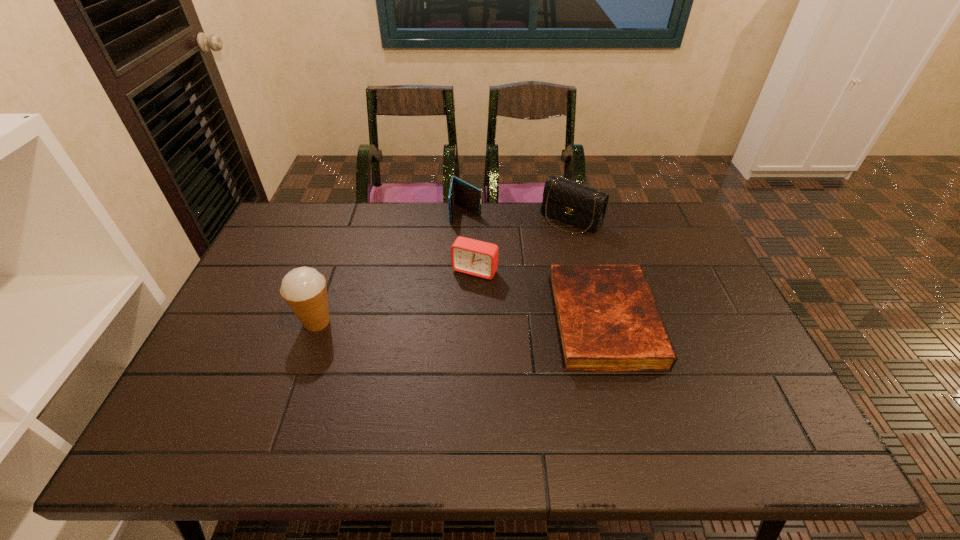
Find the location of a particular element. Image resolution: width=960 pixels, height=540 pixels. free space located on the exterior surface of the wallet is located at coordinates (460, 269).

In order to click on free location located 0.210m on the front-facing side of the alarm clock in this screenshot , I will do `click(439, 333)`.

The height and width of the screenshot is (540, 960). In order to click on free location located 0.090m on the front-facing side of the alarm clock in this screenshot , I will do [x=455, y=302].

Locate an element on the screen. The height and width of the screenshot is (540, 960). vacant space located on the front-facing side of the alarm clock is located at coordinates (430, 347).

Locate an element on the screen. Image resolution: width=960 pixels, height=540 pixels. vacant space located 0.180m on the front flap of the clutch bag is located at coordinates (531, 262).

In order to click on vacant point located 0.190m on the front flap of the clutch bag in this screenshot , I will do `click(529, 264)`.

Locate an element on the screen. The image size is (960, 540). free space located 0.390m on the front flap of the clutch bag is located at coordinates (494, 303).

The height and width of the screenshot is (540, 960). What are the coordinates of `wallet that is positioned at the far edge` in the screenshot? It's located at (461, 193).

Where is `clutch bag that is at the far edge`? The image size is (960, 540). clutch bag that is at the far edge is located at coordinates (582, 206).

The height and width of the screenshot is (540, 960). Find the location of `vacant space at the far edge of the desktop`. vacant space at the far edge of the desktop is located at coordinates (418, 218).